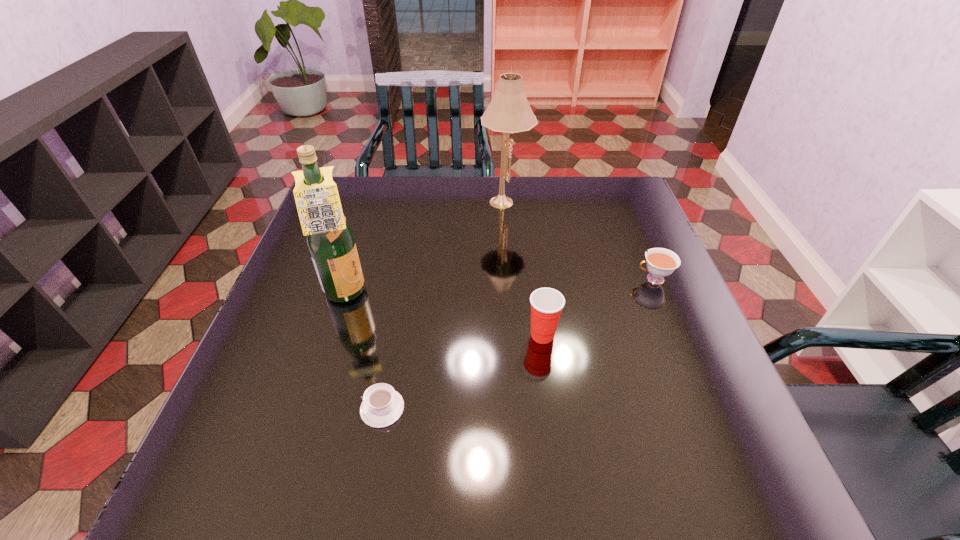
In order to click on the farthest object in this screenshot , I will do `click(509, 112)`.

In order to click on liquor in this screenshot , I will do `click(330, 240)`.

Locate an element on the screen. This screenshot has height=540, width=960. the second nearest object is located at coordinates (546, 303).

The image size is (960, 540). In order to click on Dixie cup in this screenshot , I will do pyautogui.click(x=546, y=303).

Where is `the taller teacup`? This screenshot has height=540, width=960. the taller teacup is located at coordinates (661, 262).

Locate an element on the screen. the farther teacup is located at coordinates (661, 262).

The width and height of the screenshot is (960, 540). I want to click on the nearest object, so click(x=382, y=406).

Where is `the nearer teacup`? the nearer teacup is located at coordinates pyautogui.click(x=382, y=406).

Image resolution: width=960 pixels, height=540 pixels. Identify the location of vacant space situated 0.350m on the front of the farthest object. (513, 300).

The image size is (960, 540). I want to click on free location located on the front-facing side of the liquor, so click(x=405, y=294).